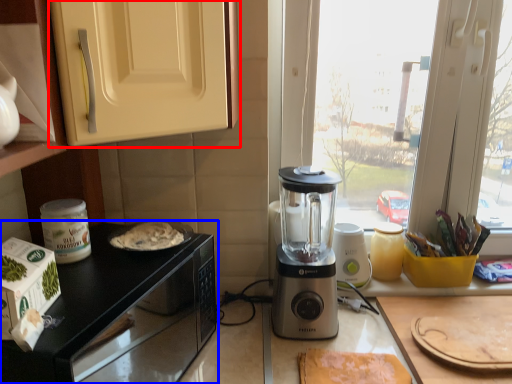
Question: Which point is further to the camera, cabinetry (highlighted by a red box) or countertop (highlighted by a blue box)?

Choices:
 (A) cabinetry
 (B) countertop

Answer: (B)